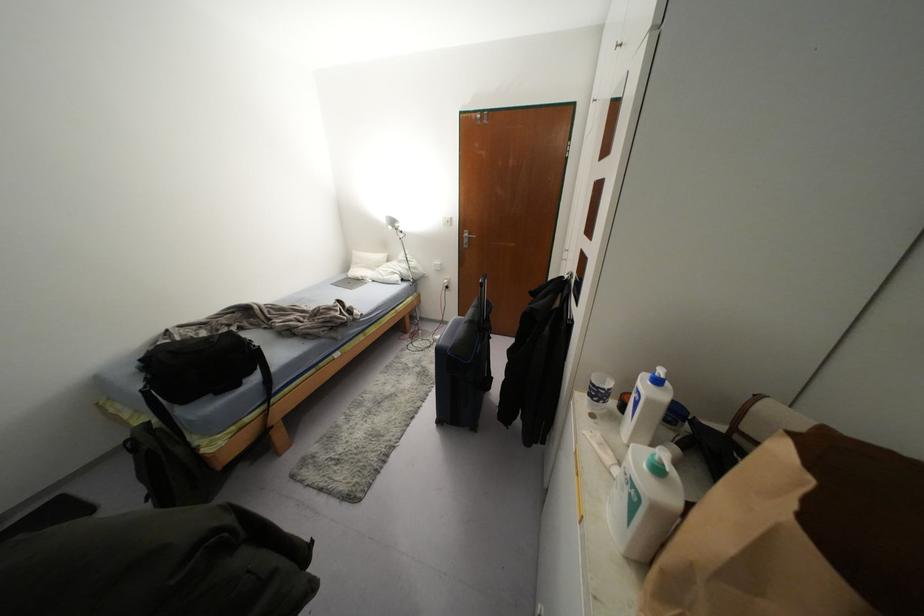
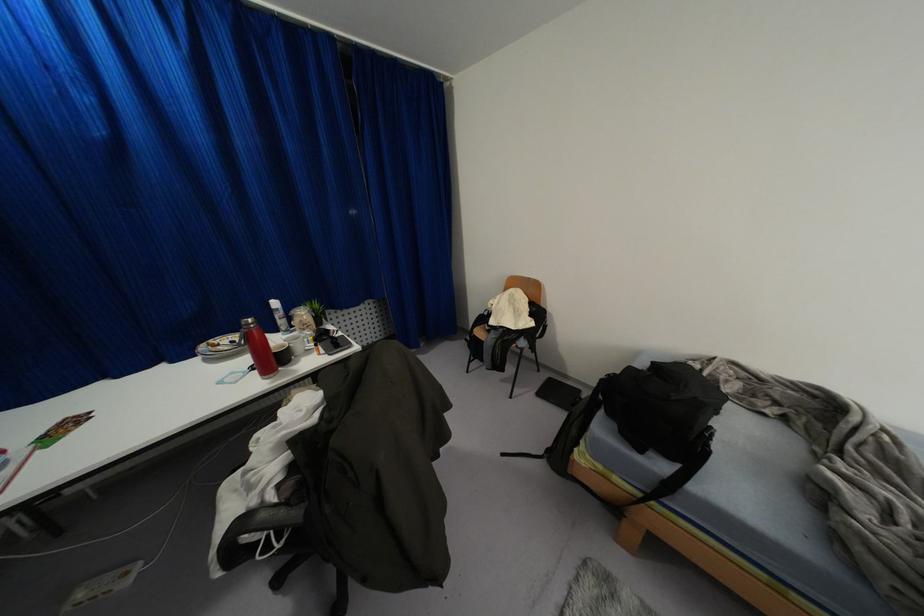
First-person continuous shooting, in which direction is the camera rotating?

The camera's rotation is toward left-down.